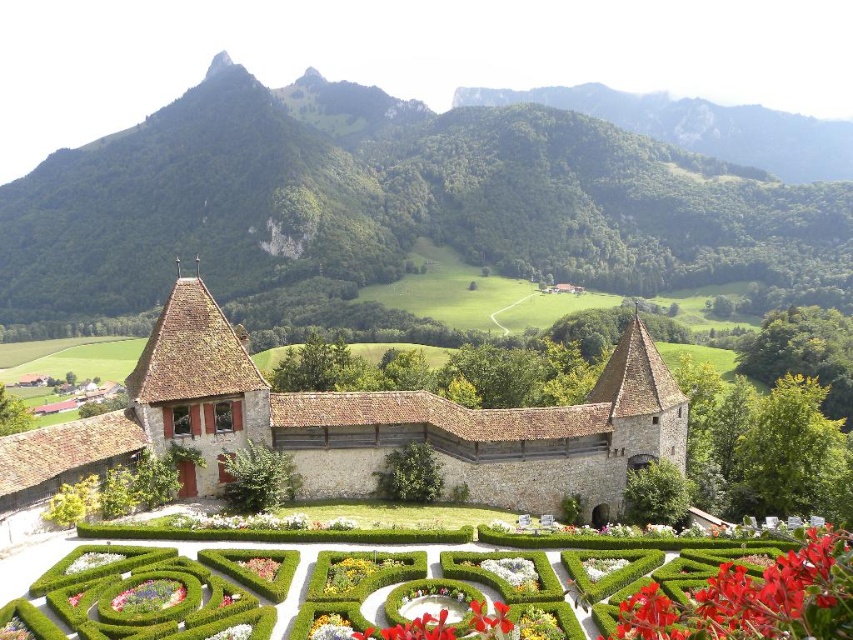
Question: Is green hedge maze at center thinner than green leafy hedge at lower right?

Choices:
 (A) no
 (B) yes

Answer: (A)

Question: Which of the following is the closest to the observer?

Choices:
 (A) fluffy pink flower at lower center
 (B) brown stone church at center
 (C) red matte flower at lower right
 (D) matte green hedge at lower left

Answer: (C)

Question: Is matte green hedge at lower left positioned behind fluffy pink flower at lower center?

Choices:
 (A) yes
 (B) no

Answer: (A)

Question: Which point is closer to the camera taking this photo?

Choices:
 (A) (354, 145)
 (B) (218, 636)

Answer: (B)

Question: Is brown stone church at center positioned before matte green hedge at lower left?

Choices:
 (A) no
 (B) yes

Answer: (A)

Question: Which point is closer to the camera taking this photo?

Choices:
 (A) (386, 401)
 (B) (679, 509)
 (C) (422, 166)
 (D) (244, 634)

Answer: (D)